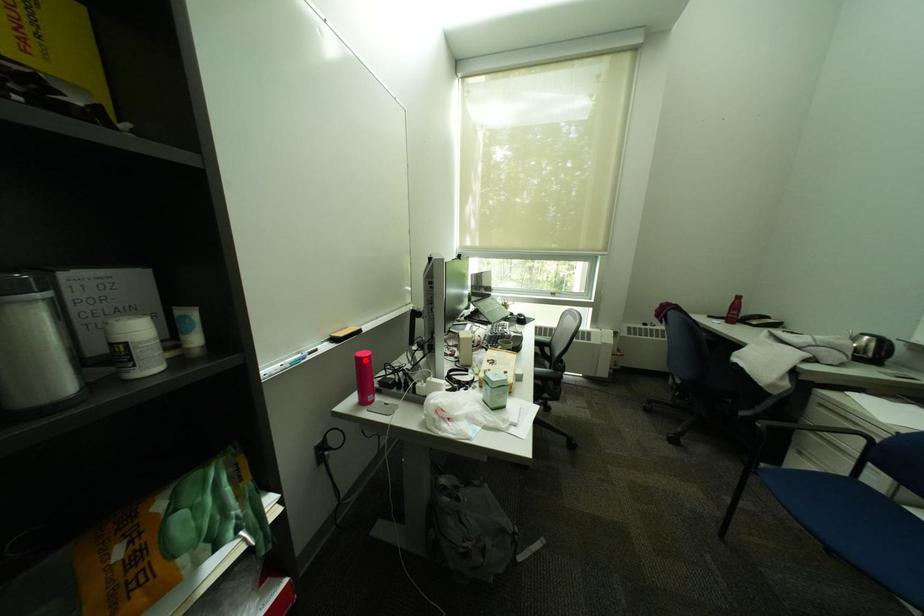
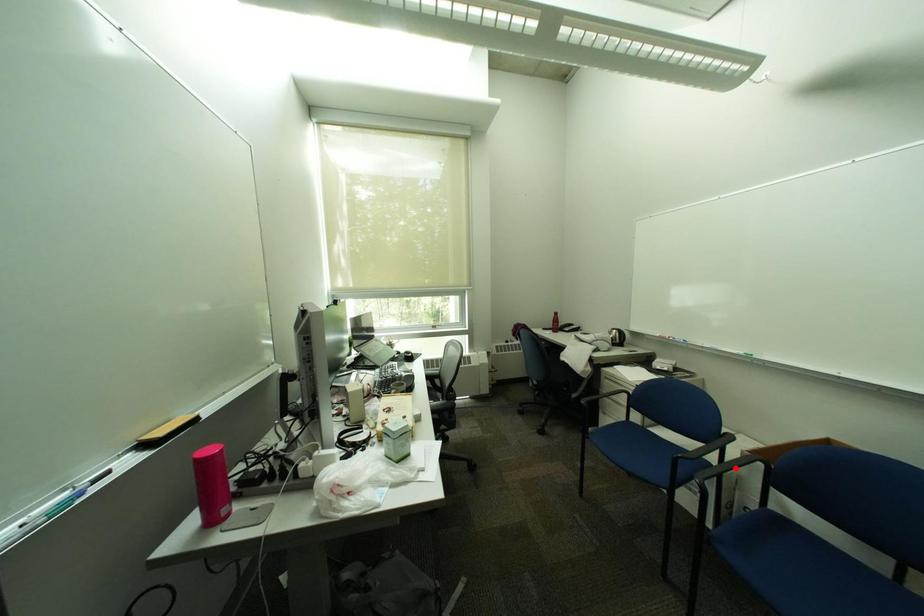
I am providing you with two images of the same scene from different viewpoints. A red point is marked on the first image and another point is marked on the second image. Are the points marked in image1 and image2 representing the same 3D position?

No